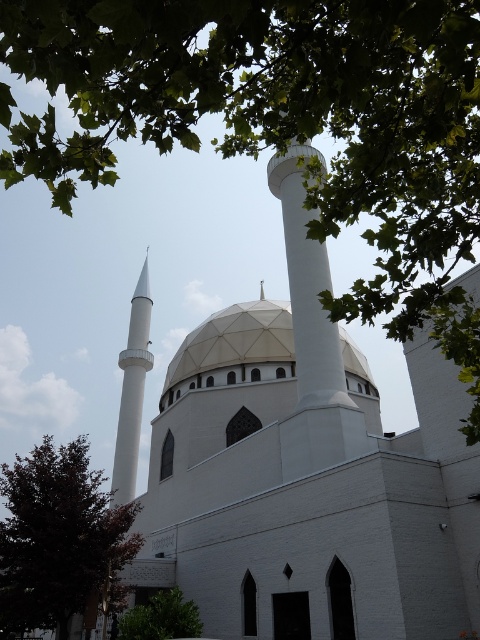
You are standing in front of the mosque and want to take a photo that includes both the green leafy tree at upper center and the white smooth minaret at center. Which object appears taller in the photo?

The green leafy tree at upper center appears taller than the white smooth minaret at center in the photo.

Based on the scene description, which object is wider between the white textured dome at center and the white smooth minaret at center?

The white textured dome at center is wider than the white smooth minaret at center according to the description.

You are standing in front of the mosque and notice the green leafy tree at upper center and the white smooth minaret at center. Which object is positioned to the left when viewed from your perspective?

The green leafy tree at upper center is positioned to the left of the white smooth minaret at center.